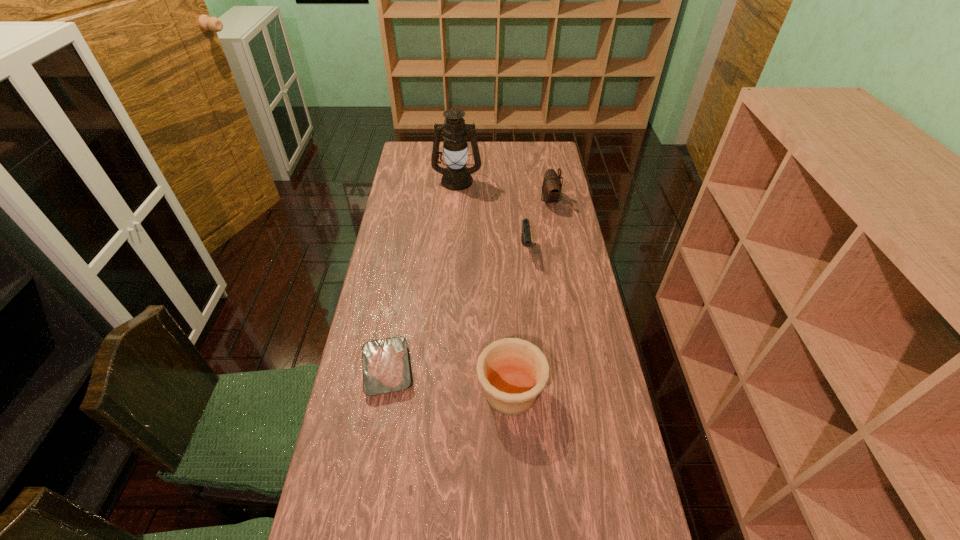
The height and width of the screenshot is (540, 960). I want to click on unoccupied area between the third nearest object and the shortest object, so click(x=456, y=309).

This screenshot has height=540, width=960. What are the coordinates of `vacant area that lies between the pistol and the pottery` in the screenshot? It's located at (518, 320).

Locate an element on the screen. blank region between the tallest object and the pottery is located at coordinates (484, 286).

At what (x,y) coordinates should I click in order to perform the action: click on vacant space that is in between the oil lamp and the steak. Please return your answer as a coordinate pair (x, y). Looking at the image, I should click on (422, 275).

What are the coordinates of `empty location between the third nearest object and the pottery` in the screenshot? It's located at (518, 320).

This screenshot has height=540, width=960. Identify the location of free space between the pottery and the steak. (449, 381).

Identify the location of vacant area that lies between the shortest object and the rightmost object. (468, 285).

Locate an element on the screen. free space between the pottery and the tallest object is located at coordinates (484, 286).

This screenshot has width=960, height=540. Identify the location of free space between the rightmost object and the fourth tallest object. (538, 224).

Find the location of a particular element. This screenshot has width=960, height=540. vacant space that's between the pottery and the shortest object is located at coordinates (449, 381).